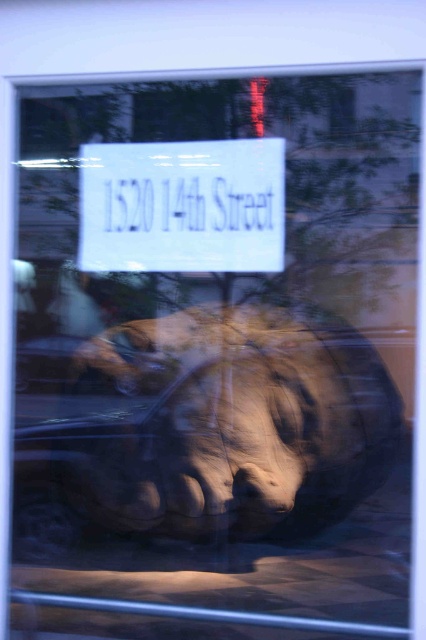
Question: Can you confirm if matte brown sculpture at center is wider than white paper sign at center?

Choices:
 (A) no
 (B) yes

Answer: (B)

Question: Which point is closer to the camera?

Choices:
 (A) white paper sign at upper center
 (B) white paper sign at center

Answer: (B)

Question: Is matte brown sculpture at center to the right of white paper sign at upper center from the viewer's perspective?

Choices:
 (A) yes
 (B) no

Answer: (A)

Question: Estimate the real-world distances between objects in this image. Which object is farther from the white paper sign at upper center?

Choices:
 (A) white paper sign at center
 (B) matte brown sculpture at center

Answer: (B)

Question: Does white paper sign at center appear under white paper sign at upper center?

Choices:
 (A) no
 (B) yes

Answer: (B)

Question: Which of these objects is positioned closest to the white paper sign at upper center?

Choices:
 (A) white paper sign at center
 (B) matte brown sculpture at center

Answer: (A)